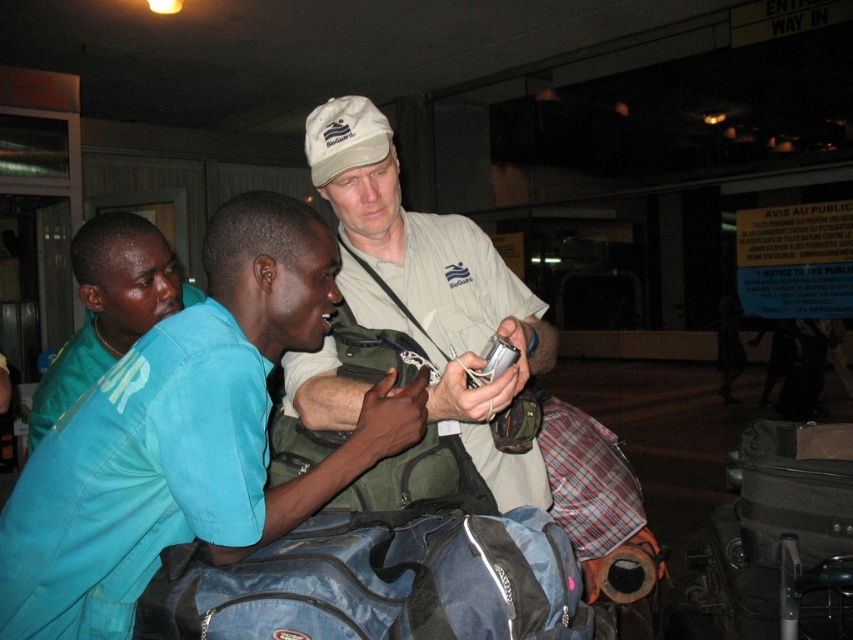
You are a security officer in the airport and you see the blue fabric duffel bag at center and the khaki cotton cap at center. Which object is positioned to the left?

The blue fabric duffel bag at center is to the left of khaki cotton cap at center.